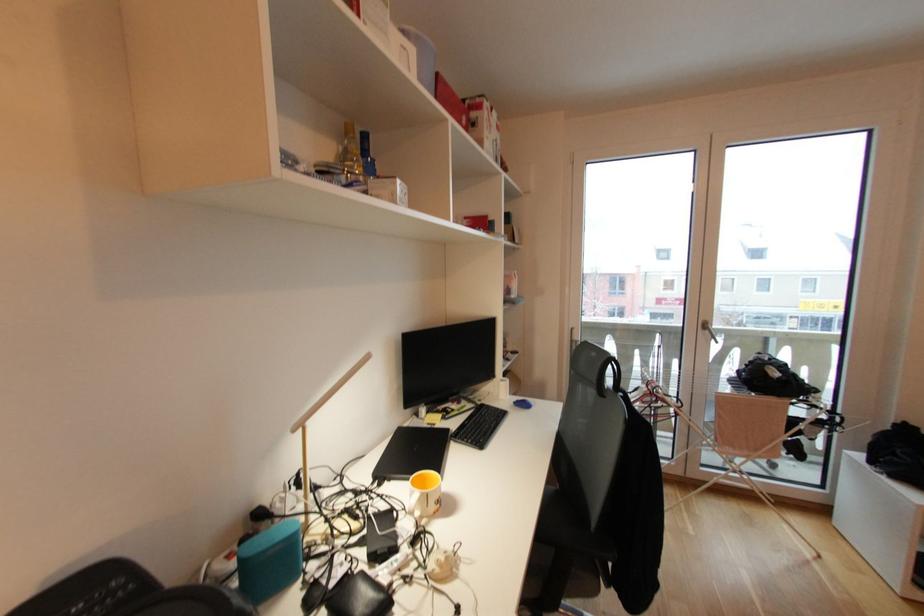
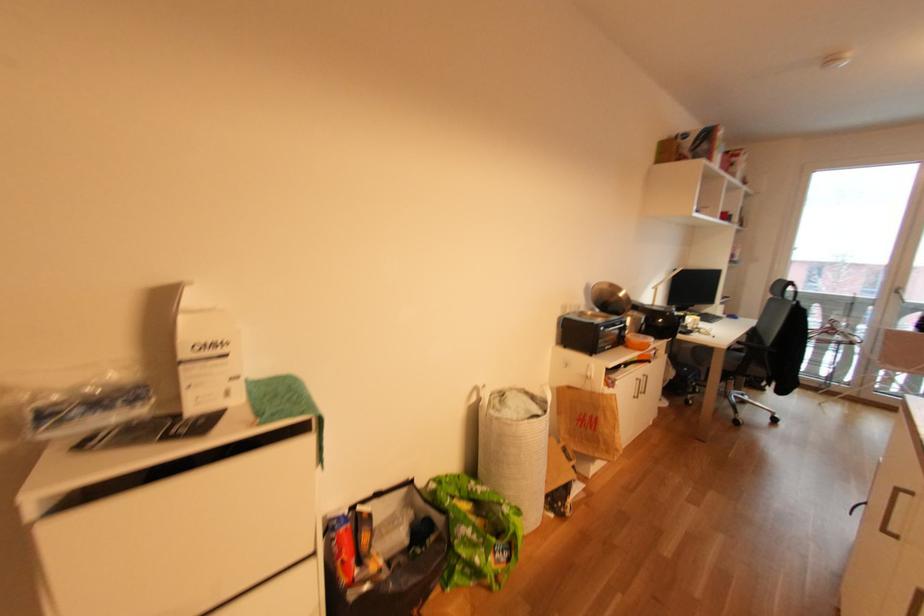
Question: The images are taken continuously from a first-person perspective. In which direction are you moving?

Choices:
 (A) Left
 (B) Right
 (C) Forward
 (D) Backward

Answer: (D)